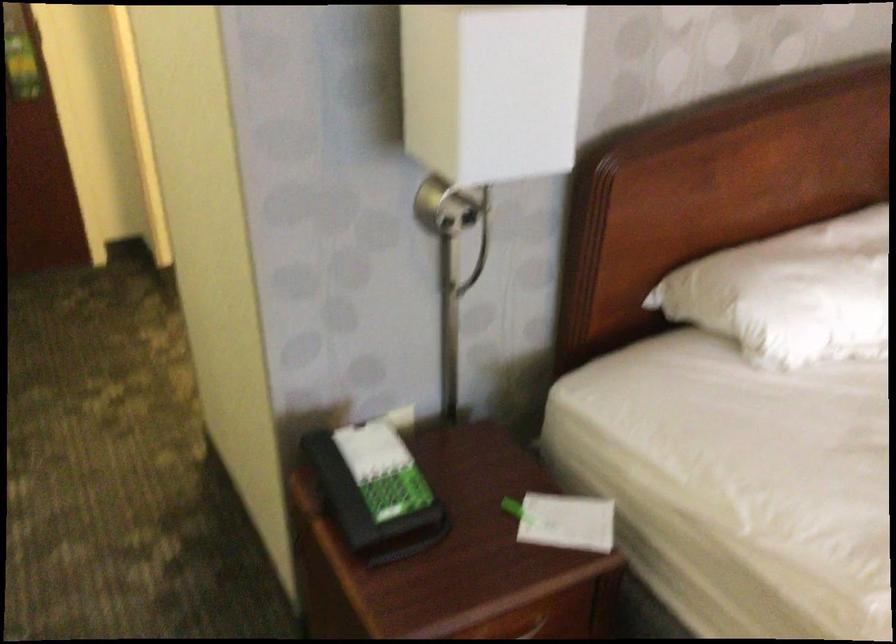
Describe the element at coordinates (798, 297) in the screenshot. This screenshot has height=644, width=896. I see `the white pillow` at that location.